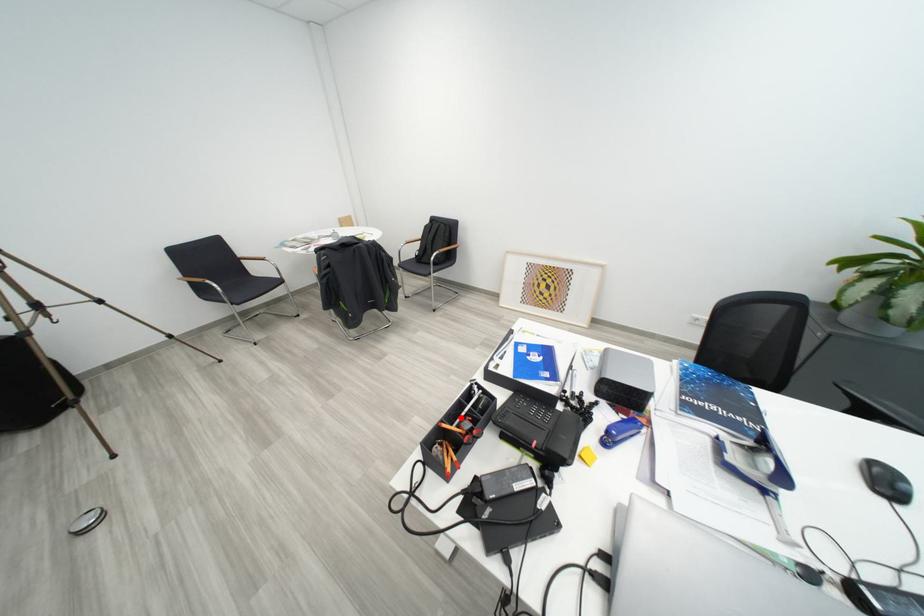
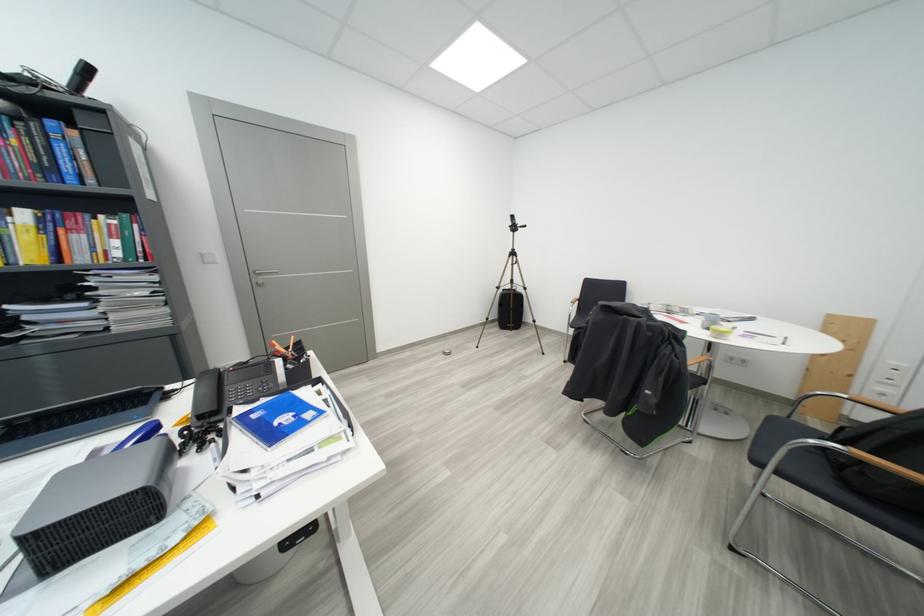
Question: I am providing you with two images of the same scene from different viewpoints. A red point is marked on the first image. Is the red point's position out of view in image 2?

Choices:
 (A) Yes
 (B) No

Answer: (A)